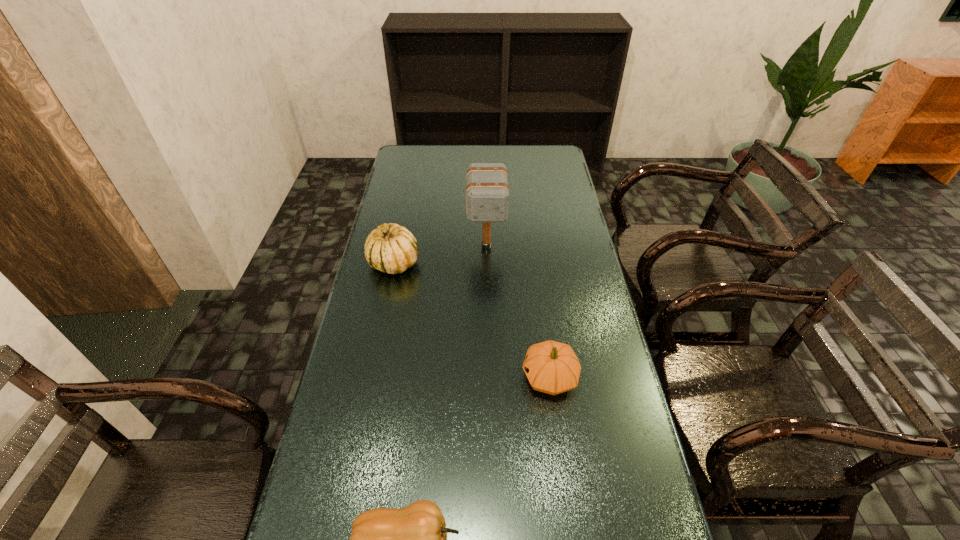
At what (x,y) coordinates should I click in order to perform the action: click on object present at the right edge. Please return your answer as a coordinate pair (x, y). Looking at the image, I should click on (551, 367).

In the image, there is a desktop. Where is `vacant space at the left edge`? vacant space at the left edge is located at coordinates (315, 498).

Find the location of a particular element. This screenshot has height=540, width=960. free region at the right edge of the desktop is located at coordinates (550, 174).

In the image, there is a desktop. At what (x,y) coordinates should I click in order to perform the action: click on vacant space at the far left corner. Please return your answer as a coordinate pair (x, y). Image resolution: width=960 pixels, height=540 pixels. Looking at the image, I should click on (421, 157).

Locate an element on the screen. The width and height of the screenshot is (960, 540). blank region between the mallet and the farthest gourd is located at coordinates (440, 255).

Identify the location of vacant space in between the farthest gourd and the tallest object. (440, 255).

Image resolution: width=960 pixels, height=540 pixels. I want to click on object that is the closest to the nearest gourd, so click(551, 367).

I want to click on object that is the second closest to the tallest object, so click(551, 367).

Identify which gourd is located as the second nearest to the rightmost object. Please provide its 2D coordinates. Your answer should be formatted as a tuple, i.e. [(x, y)], where the tuple contains the x and y coordinates of a point satisfying the conditions above.

[(392, 249)]

Identify the location of gourd identified as the third closest to the tallest object. This screenshot has height=540, width=960. (413, 539).